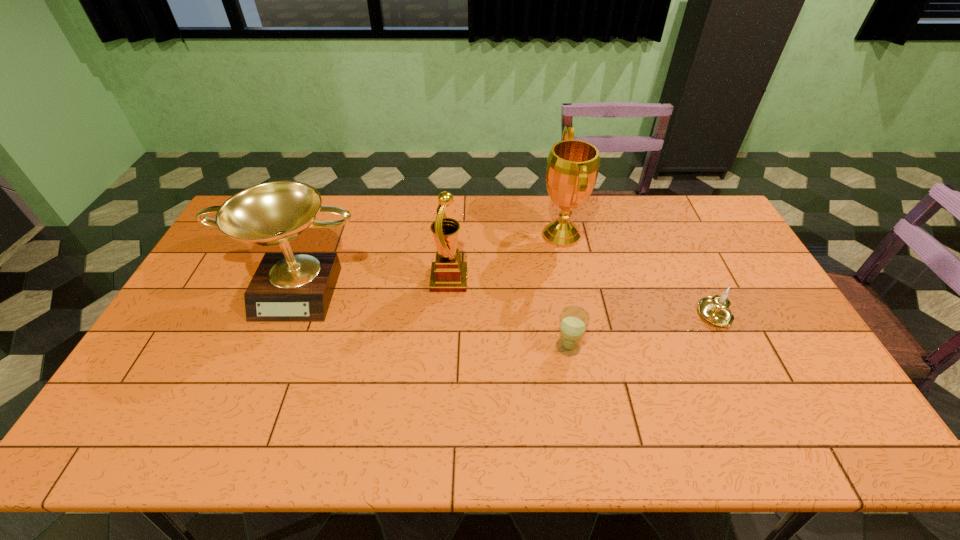
Select which object appears as the closest to the fourth object from right to left. Please provide its 2D coordinates. Your answer should be formatted as a tuple, i.e. [(x, y)], where the tuple contains the x and y coordinates of a point satisfying the conditions above.

[(287, 287)]

Where is `award object that ranks as the second closest to the second object from left to right`? award object that ranks as the second closest to the second object from left to right is located at coordinates (572, 169).

Identify the location of the second closest award to the rightmost award. pos(287,287).

Where is `vacant point that satisfies the following two spatial constraints: 1. on the front-facing side of the glass; 2. on the left side of the second object from left to right`? vacant point that satisfies the following two spatial constraints: 1. on the front-facing side of the glass; 2. on the left side of the second object from left to right is located at coordinates (444, 347).

You are a GUI agent. You are given a task and a screenshot of the screen. Output one action in this format:
    pyautogui.click(x=<x>, y=<y>)
    Task: Click on the vacant space that satisfies the following two spatial constraints: 1. on the front-facing side of the leftmost award; 2. on the left side of the nearest object
    The height and width of the screenshot is (540, 960).
    Given the screenshot: What is the action you would take?
    pyautogui.click(x=277, y=347)

Find the location of a particular element. vacant space that satisfies the following two spatial constraints: 1. on the front-facing side of the leftmost object; 2. on the right side of the nearest object is located at coordinates (277, 347).

Locate an element on the screen. vacant space that satisfies the following two spatial constraints: 1. on the front-facing side of the second award from right to left; 2. on the back side of the glass is located at coordinates (444, 347).